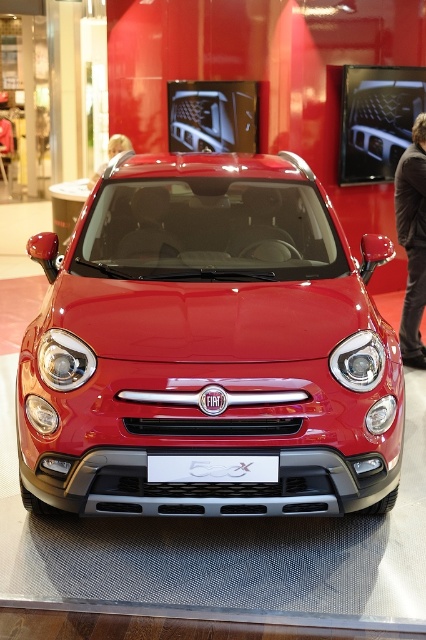
Is glossy red car at center above white plastic license plate at center?

Correct, glossy red car at center is located above white plastic license plate at center.

Who is shorter, glossy red car at center or white plastic license plate at center?

Standing shorter between the two is white plastic license plate at center.

Locate an element on the screen. The image size is (426, 640). glossy red car at center is located at coordinates (x=209, y=342).

Is point (400, 385) behind point (414, 324)?

That is False.

Who is positioned more to the left, glossy red car at center or dark brown leather jacket at right?

Answer: glossy red car at center

Find the location of a particular element. The image size is (426, 640). glossy red car at center is located at coordinates (209, 342).

Between dark brown leather jacket at right and matte red car at upper left, which one appears on the right side from the viewer's perspective?

dark brown leather jacket at right is more to the right.

Does dark brown leather jacket at right lie behind matte red car at upper left?

That is False.

Which is in front, point (405, 208) or point (111, 147)?

Point (405, 208) is more forward.

Identify the location of dark brown leather jacket at right. The width and height of the screenshot is (426, 640). (412, 241).